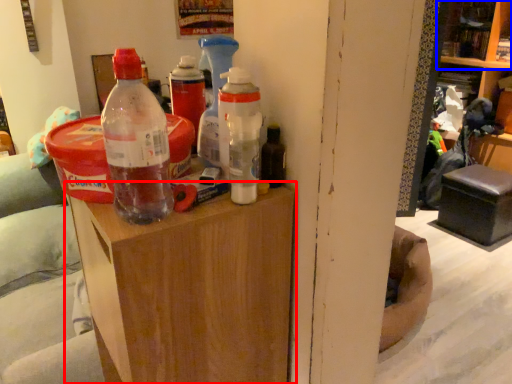
Question: Which of the following is the closest to the observer, furniture (highlighted by a red box) or shelf (highlighted by a blue box)?

Choices:
 (A) furniture
 (B) shelf

Answer: (A)